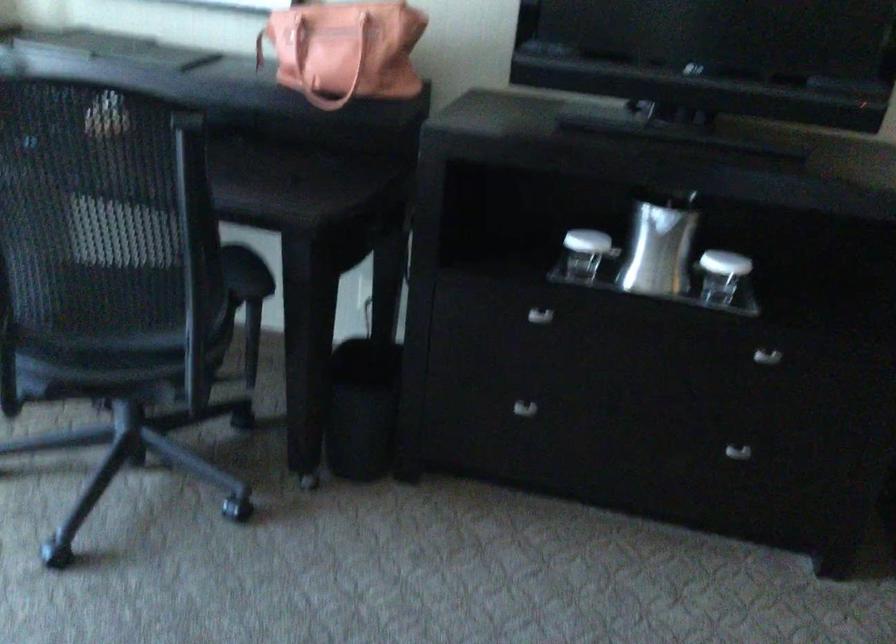
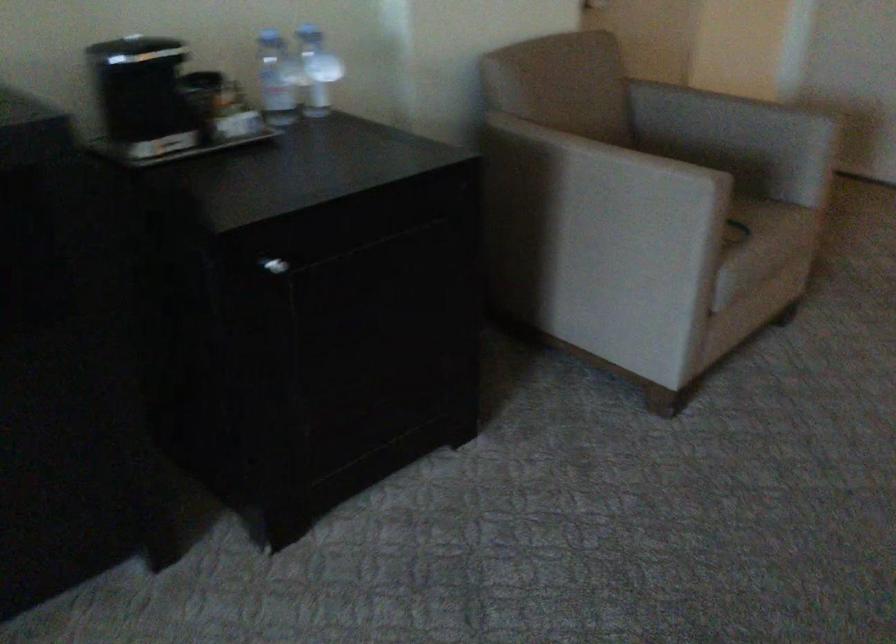
The first image is from the beginning of the video and the second image is from the end. How did the camera likely rotate when shooting the video?

The rotation direction of the camera is right-down.